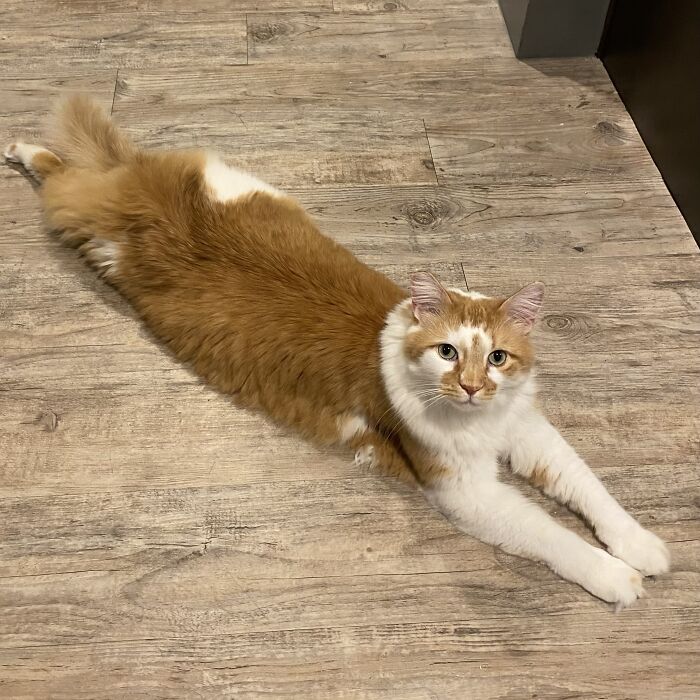
The height and width of the screenshot is (700, 700). Find the location of `floor`. floor is located at coordinates (433, 28).